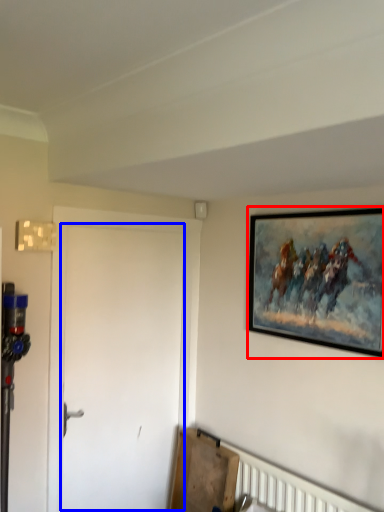
Question: Which object is closer to the camera taking this photo, picture frame (highlighted by a red box) or door (highlighted by a blue box)?

Choices:
 (A) picture frame
 (B) door

Answer: (A)